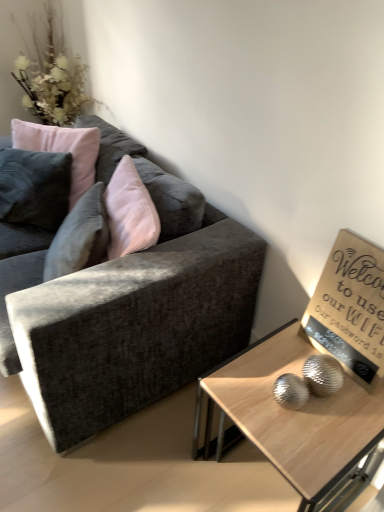
Question: Considering the positions of wooden sign at upper right and velvet dark gray couch at left in the image, is wooden sign at upper right bigger or smaller than velvet dark gray couch at left?

Choices:
 (A) small
 (B) big

Answer: (A)

Question: From a real-world perspective, is wooden sign at upper right positioned above or below velvet dark gray couch at left?

Choices:
 (A) above
 (B) below

Answer: (A)

Question: Which object is the farthest from the wooden sign at upper right?

Choices:
 (A) velvet pink pillow at upper left
 (B) velvet dark gray couch at left
 (C) white fluffy flowers at upper left
 (D) wooden glossy coffee table at lower right

Answer: (C)

Question: Estimate the real-world distances between objects in this image. Which object is closer to the velvet dark gray couch at left?

Choices:
 (A) white fluffy flowers at upper left
 (B) wooden glossy coffee table at lower right
 (C) velvet pink pillow at upper left
 (D) wooden sign at upper right

Answer: (B)